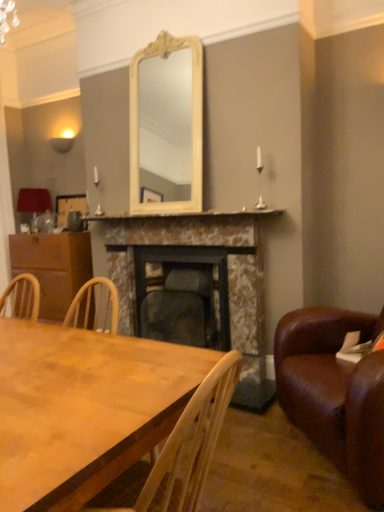
Where is `wooden picture frame at left`? The height and width of the screenshot is (512, 384). wooden picture frame at left is located at coordinates (69, 207).

This screenshot has height=512, width=384. What do you see at coordinates (184, 264) in the screenshot?
I see `dark gray stone fireplace at center, the 2th fireplace positioned from the right` at bounding box center [184, 264].

Describe the element at coordinates (214, 278) in the screenshot. I see `marble fireplace at center, the second fireplace viewed from the left` at that location.

This screenshot has width=384, height=512. What do you see at coordinates (84, 409) in the screenshot? I see `wooden table at lower left` at bounding box center [84, 409].

You are a GUI agent. You are given a task and a screenshot of the screen. Output one action in this format:
    pyautogui.click(x=<x>, y=<y>)
    Task: Click on the brown wood cabinet at left
    The width and height of the screenshot is (384, 512).
    Given the screenshot: What is the action you would take?
    pyautogui.click(x=53, y=267)

From a real-world perspective, which object rests below the other?

In real-world perspective, brown leather couch at right is lower.

From the image's perspective, is brown leather couch at right located above or below brown wood cabinet at left?

Clearly, from the image's perspective, brown leather couch at right is below brown wood cabinet at left.

Is brown leather couch at right positioned far away from brown wood cabinet at left?

Yes, brown leather couch at right is far from brown wood cabinet at left.

Can you confirm if wooden picture frame at left is positioned to the left of wooden table at lower left?

Indeed, wooden picture frame at left is positioned on the left side of wooden table at lower left.

Between wooden picture frame at left and wooden table at lower left, which one has smaller width?

wooden picture frame at left.

Considering their positions, is wooden picture frame at left located in front of or behind wooden table at lower left?

In the image, wooden picture frame at left appears behind wooden table at lower left.

Does brown leather couch at right turn towards marble fireplace at center, the second fireplace viewed from the left?

No, brown leather couch at right is not turned towards marble fireplace at center, the second fireplace viewed from the left.

Considering the sizes of brown leather couch at right and marble fireplace at center, the second fireplace viewed from the left, in the image, is brown leather couch at right bigger or smaller than marble fireplace at center, the second fireplace viewed from the left,?

Considering their sizes, brown leather couch at right takes up more space than marble fireplace at center, the second fireplace viewed from the left.

From the image's perspective, does brown leather couch at right appear higher than marble fireplace at center, the second fireplace viewed from the left?

Incorrect, from the image's perspective, brown leather couch at right is lower than marble fireplace at center, the second fireplace viewed from the left.

How many degrees apart are the facing directions of brown leather couch at right and marble fireplace at center, the first fireplace when ordered from right to left?

They differ by 45.1 degrees in their facing directions.

Between marble fireplace at center, the second fireplace viewed from the left, and brown wood cabinet at left, which one has smaller size?

With smaller size is brown wood cabinet at left.

Locate an element on the screen. This screenshot has height=512, width=384. cabinetry that is behind the marble fireplace at center, the second fireplace viewed from the left is located at coordinates pos(53,267).

Do you think marble fireplace at center, the first fireplace when ordered from right to left, is within brown wood cabinet at left, or outside of it?

marble fireplace at center, the first fireplace when ordered from right to left, is located beyond the bounds of brown wood cabinet at left.

Considering the sizes of objects marble fireplace at center, the first fireplace when ordered from right to left, and wooden table at lower left in the image provided, who is thinner, marble fireplace at center, the first fireplace when ordered from right to left, or wooden table at lower left?

Thinner between the two is marble fireplace at center, the first fireplace when ordered from right to left.

Looking at the image, does marble fireplace at center, the first fireplace when ordered from right to left, seem bigger or smaller compared to wooden table at lower left?

marble fireplace at center, the first fireplace when ordered from right to left, is bigger than wooden table at lower left.

Looking at this image, is marble fireplace at center, the second fireplace viewed from the left, with wooden table at lower left?

No.

How far apart are marble fireplace at center, the first fireplace when ordered from right to left, and wooden table at lower left?

marble fireplace at center, the first fireplace when ordered from right to left, is 5.10 feet away from wooden table at lower left.

Is marble fireplace at center, the second fireplace viewed from the left, far from wooden picture frame at left?

Absolutely, marble fireplace at center, the second fireplace viewed from the left, is distant from wooden picture frame at left.

From a real-world perspective, starting from the wooden picture frame at left, which fireplace is the 1st one below it? Please provide its 2D coordinates.

[(214, 278)]

Between point (252, 283) and point (76, 210), which one is positioned behind?

Point (76, 210)

What's the angular difference between marble fireplace at center, the second fireplace viewed from the left, and wooden picture frame at left's facing directions?

0.0989 degrees.

Does brown leather couch at right have a greater width compared to wooden picture frame at left?

Indeed, brown leather couch at right has a greater width compared to wooden picture frame at left.

Is brown leather couch at right to the right of wooden picture frame at left from the viewer's perspective?

Indeed, brown leather couch at right is positioned on the right side of wooden picture frame at left.

Based on their sizes in the image, would you say brown leather couch at right is bigger or smaller than wooden picture frame at left?

Considering their sizes, brown leather couch at right takes up more space than wooden picture frame at left.

The width and height of the screenshot is (384, 512). I want to click on cabinetry behind the brown leather couch at right, so click(x=53, y=267).

Identify the location of picture frame positioned vertically above the wooden table at lower left (from a real-world perspective). Image resolution: width=384 pixels, height=512 pixels. (69, 207).

From the image, which object appears to be nearer to brown leather couch at right, marble fireplace at center, the first fireplace when ordered from right to left, or wooden table at lower left?

marble fireplace at center, the first fireplace when ordered from right to left.

Considering their positions, is marble mantelpiece at center positioned closer to marble fireplace at center, the second fireplace viewed from the left, than brown leather couch at right?

marble mantelpiece at center is closer to marble fireplace at center, the second fireplace viewed from the left.

From the image, which object appears to be nearer to marble mantelpiece at center, wooden table at lower left or brown wood cabinet at left?

Among the two, brown wood cabinet at left is located nearer to marble mantelpiece at center.

Based on their spatial positions, is marble mantelpiece at center or wooden picture frame at left further from wooden table at lower left?

wooden picture frame at left is further to wooden table at lower left.

From the picture: Considering their positions, is wooden table at lower left positioned further to marble fireplace at center, the first fireplace when ordered from right to left, than dark gray stone fireplace at center, the 2th fireplace positioned from the right?

Among the two, wooden table at lower left is located further to marble fireplace at center, the first fireplace when ordered from right to left.

Considering their positions, is matte red lampshade at left positioned closer to brown leather couch at right than wooden table at lower left?

wooden table at lower left is positioned closer to the anchor brown leather couch at right.

Estimate the real-world distances between objects in this image. Which object is closer to marble fireplace at center, the first fireplace when ordered from right to left, brown leather couch at right or dark gray stone fireplace at center, the 1th fireplace viewed from the left?

The object closer to marble fireplace at center, the first fireplace when ordered from right to left, is dark gray stone fireplace at center, the 1th fireplace viewed from the left.

Estimate the real-world distances between objects in this image. Which object is closer to brown wood cabinet at left, marble fireplace at center, the first fireplace when ordered from right to left, or matte red lampshade at left?

Answer: Based on the image, matte red lampshade at left appears to be nearer to brown wood cabinet at left.

You are a GUI agent. You are given a task and a screenshot of the screen. Output one action in this format:
    pyautogui.click(x=<x>, y=<y>)
    Task: Click on the picture frame between matte red lampshade at left and marble fireplace at center, the first fireplace when ordered from right to left, in the horizontal direction
    The width and height of the screenshot is (384, 512).
    Given the screenshot: What is the action you would take?
    pyautogui.click(x=69, y=207)

Where is `fireplace between marble fireplace at center, the first fireplace when ordered from right to left, and wooden picture frame at left from front to back`? Image resolution: width=384 pixels, height=512 pixels. fireplace between marble fireplace at center, the first fireplace when ordered from right to left, and wooden picture frame at left from front to back is located at coordinates (184, 264).

Where is `studio couch positioned between wooden table at lower left and marble fireplace at center, the first fireplace when ordered from right to left, from near to far`? This screenshot has width=384, height=512. studio couch positioned between wooden table at lower left and marble fireplace at center, the first fireplace when ordered from right to left, from near to far is located at coordinates (335, 392).

The height and width of the screenshot is (512, 384). I want to click on fireplace between wooden table at lower left and dark gray stone fireplace at center, the 1th fireplace viewed from the left, along the z-axis, so click(214, 278).